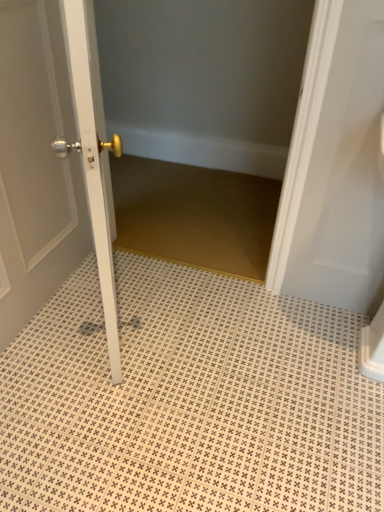
Find the location of a particular element. The width and height of the screenshot is (384, 512). free space above white textured tile at center (from a real-world perspective) is located at coordinates (181, 376).